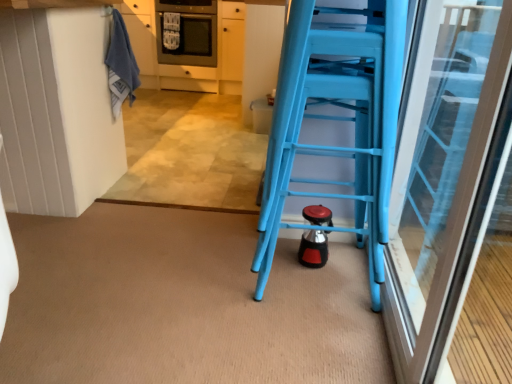
Question: Does blue plastic ladder at right have a smaller size compared to blue towel at upper left?

Choices:
 (A) yes
 (B) no

Answer: (B)

Question: From the image's perspective, does blue plastic ladder at right appear higher than blue towel at upper left?

Choices:
 (A) yes
 (B) no

Answer: (B)

Question: Is the position of blue plastic ladder at right more distant than that of blue towel at upper left?

Choices:
 (A) yes
 (B) no

Answer: (B)

Question: Is blue towel at upper left inside blue plastic ladder at right?

Choices:
 (A) no
 (B) yes

Answer: (A)

Question: Does blue plastic ladder at right have a greater width compared to blue towel at upper left?

Choices:
 (A) yes
 (B) no

Answer: (A)

Question: From a real-world perspective, is white matte cabinetry at upper left above or below satin black oven at upper center?

Choices:
 (A) below
 (B) above

Answer: (A)

Question: From the image's perspective, relative to satin black oven at upper center, is white matte cabinetry at upper left above or below?

Choices:
 (A) above
 (B) below

Answer: (B)

Question: Is white matte cabinetry at upper left wider or thinner than satin black oven at upper center?

Choices:
 (A) thin
 (B) wide

Answer: (A)

Question: Considering the relative positions of white matte cabinetry at upper left and satin black oven at upper center in the image provided, is white matte cabinetry at upper left to the left or to the right of satin black oven at upper center?

Choices:
 (A) right
 (B) left

Answer: (B)

Question: Is blue towel at upper left in front of or behind white matte cabinetry at upper left in the image?

Choices:
 (A) front
 (B) behind

Answer: (A)

Question: From the image's perspective, relative to white matte cabinetry at upper left, is blue towel at upper left above or below?

Choices:
 (A) above
 (B) below

Answer: (B)

Question: Would you say blue towel at upper left is inside or outside white matte cabinetry at upper left?

Choices:
 (A) outside
 (B) inside

Answer: (A)

Question: Considering the positions of point (121, 89) and point (153, 69), is point (121, 89) closer or farther from the camera than point (153, 69)?

Choices:
 (A) farther
 (B) closer

Answer: (B)

Question: Considering the relative positions of satin black oven at upper center and white matte cabinetry at upper left in the image provided, is satin black oven at upper center to the left or to the right of white matte cabinetry at upper left?

Choices:
 (A) right
 (B) left

Answer: (A)

Question: Considering the positions of satin black oven at upper center and white matte cabinetry at upper left in the image, is satin black oven at upper center wider or thinner than white matte cabinetry at upper left?

Choices:
 (A) wide
 (B) thin

Answer: (A)